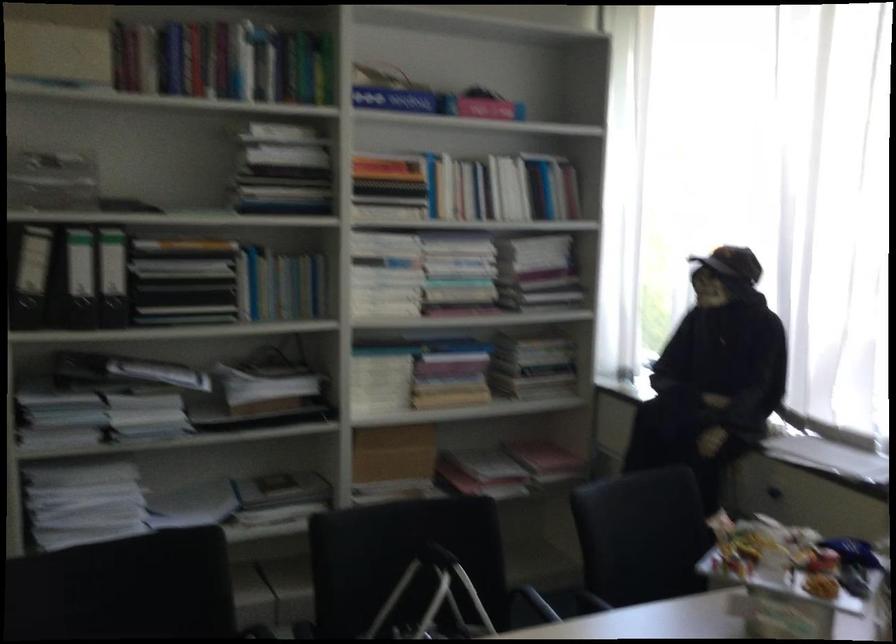
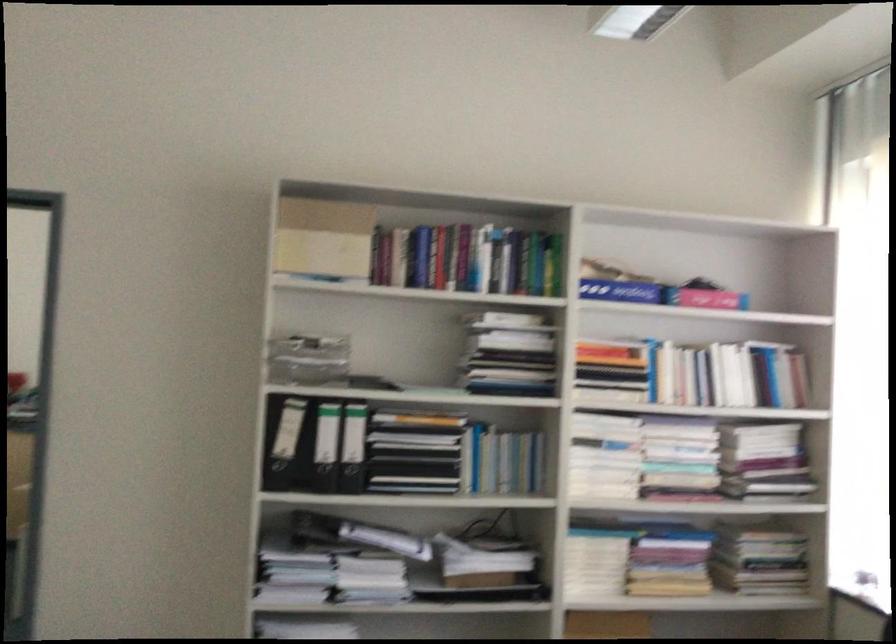
Question: The first image is from the beginning of the video and the second image is from the end. How did the camera likely rotate when shooting the video?

Choices:
 (A) Left
 (B) Right
 (C) Up
 (D) Down

Answer: (A)